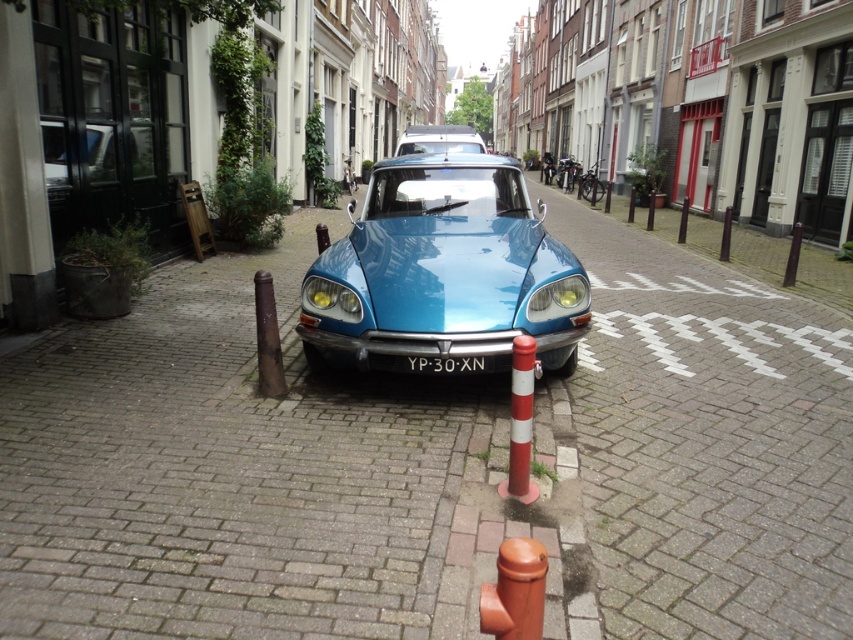
You are a delivery person trying to park your van on this narrow street. You see the smooth brick pavement at center and the brown matte hydrant at lower center. Which object is closer to the right side of the street?

The smooth brick pavement at center is to the right of the brown matte hydrant at lower center, so the smooth brick pavement at center is closer to the right side of the street.

From the picture: You are standing at the entrance of the street and want to take a photo of the matte blue car at center. According to the coordinates provided, where should you position yourself to capture it in the frame?

The matte blue car at center is located at coordinates point (444, 272), so you should position yourself at the entrance and aim your camera towards the center of the image to capture it in the frame.

You are a photographer trying to capture the shiny silver car at center and the black plastic license plate at center in a single shot. Since the license plate is small, you want to ensure it is visible. Would you need to adjust your camera to focus on closer objects or farther objects to include both in the frame?

The shiny silver car at center is larger in size than the black plastic license plate at center, which suggests that the car is closer to the camera. To include both in the frame, you should focus on closer objects to ensure the license plate remains visible.